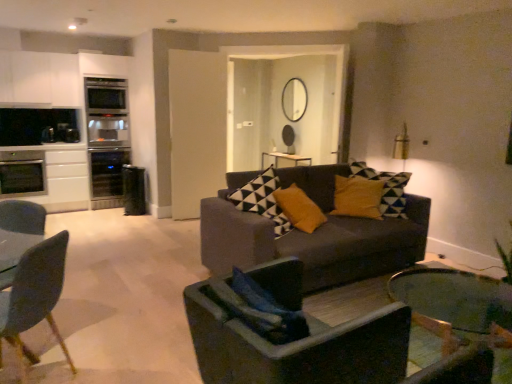
Question: From a real-world perspective, is matte gray chair at left, the first chair positioned from the left, physically located above or below dark gray fabric chair at center, the 1th chair viewed from the right?

Choices:
 (A) above
 (B) below

Answer: (A)

Question: Is point (38, 317) closer or farther from the camera than point (339, 367)?

Choices:
 (A) closer
 (B) farther

Answer: (B)

Question: Considering the real-world distances, which object is farthest from the black glass wine cooler at left, arranged as the second appliance when viewed from the right?

Choices:
 (A) matte black mirror at upper center
 (B) wooden glossy coffee table at lower center
 (C) satin silver oven at left, which is counted as the 3th appliance, starting from the right
 (D) dark gray fabric chair at center, which appears as the 2th chair when viewed from the left
 (E) matte gray couch at center

Answer: (D)

Question: Which object is positioned closest to the black glass wine cooler at left, acting as the 2th appliance starting from the left?

Choices:
 (A) dark gray fabric chair at center, the 1th chair viewed from the right
 (B) wooden glossy coffee table at lower center
 (C) white matte cabinet at upper left
 (D) matte gray couch at center
 (E) matte black mirror at upper center

Answer: (C)